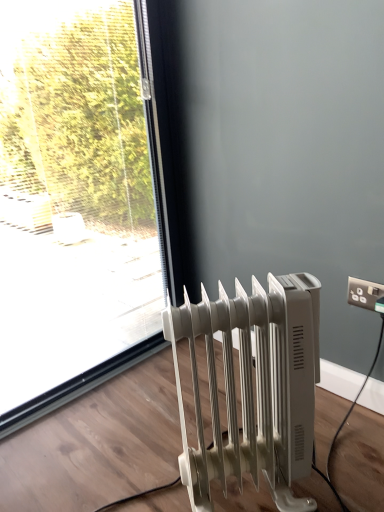
Question: From a real-world perspective, relative to white plastic radiator at lower right, is white plastic electrical outlet at upper right vertically above or below?

Choices:
 (A) above
 (B) below

Answer: (A)

Question: Based on their sizes in the image, would you say white plastic electrical outlet at upper right is bigger or smaller than white plastic radiator at lower right?

Choices:
 (A) small
 (B) big

Answer: (A)

Question: Estimate the real-world distances between objects in this image. Which object is farther from the transparent glass window at upper left?

Choices:
 (A) white plastic radiator at lower right
 (B) white plastic electrical outlet at upper right

Answer: (B)

Question: Which is farther from the white plastic electrical outlet at upper right?

Choices:
 (A) white plastic radiator at lower right
 (B) transparent glass window at upper left

Answer: (B)